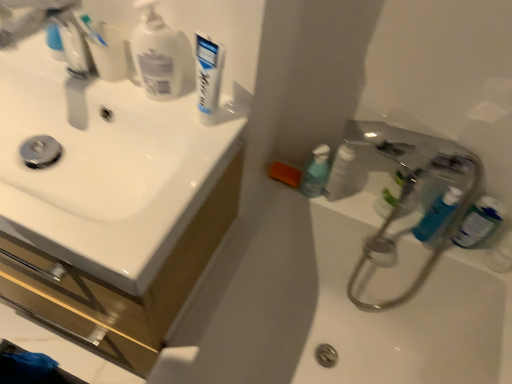
In order to click on free point to the left of blue glossy bottle at right, the 3th toiletry positioned from the left in this screenshot , I will do `click(450, 259)`.